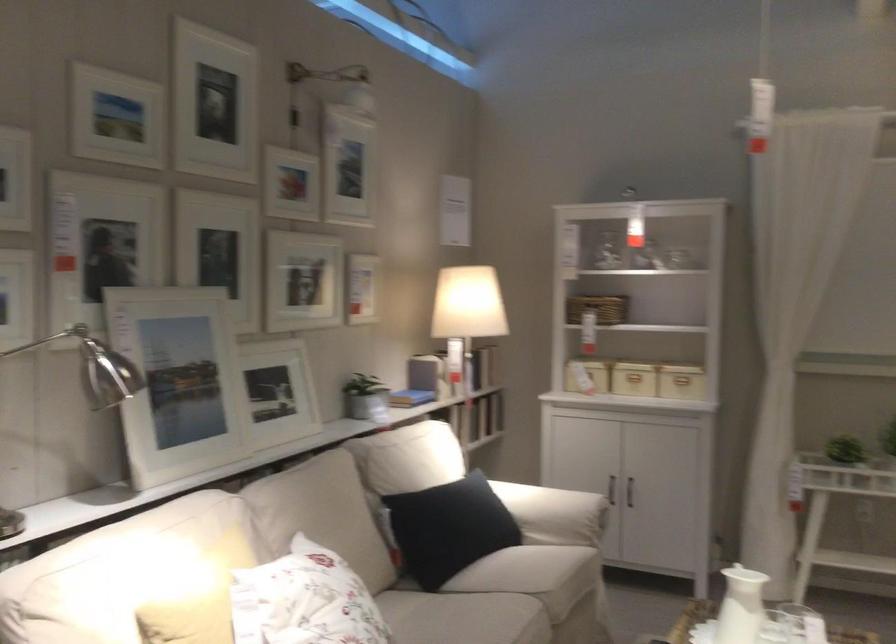
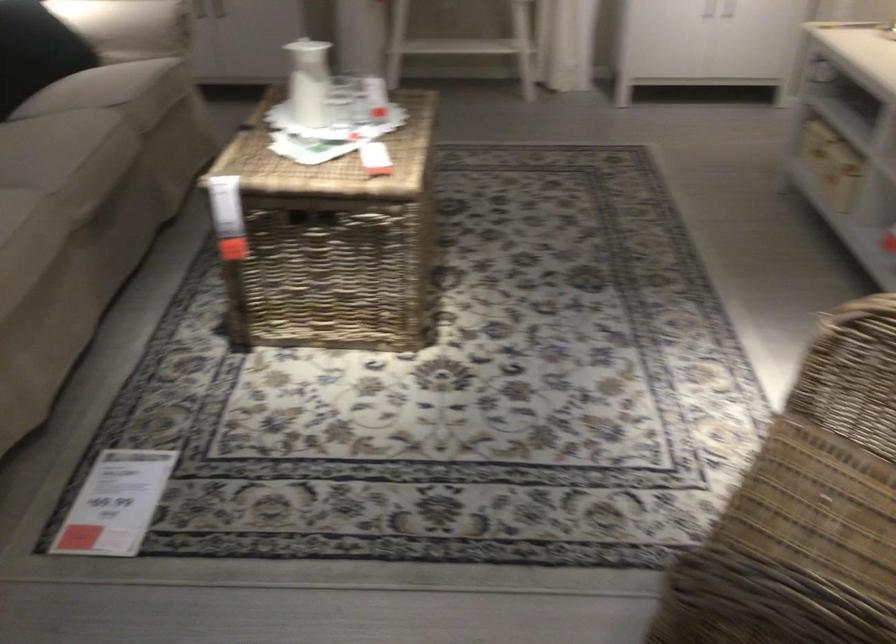
First-person continuous shooting, in which direction is the camera rotating?

The camera rotated toward right-down.